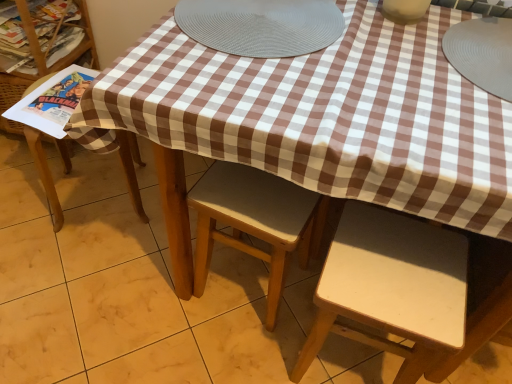
Image resolution: width=512 pixels, height=384 pixels. What are the coordinates of `free space to the left of light brown wood chair at center, which appears as the second chair when viewed from the left` in the screenshot? It's located at (163, 292).